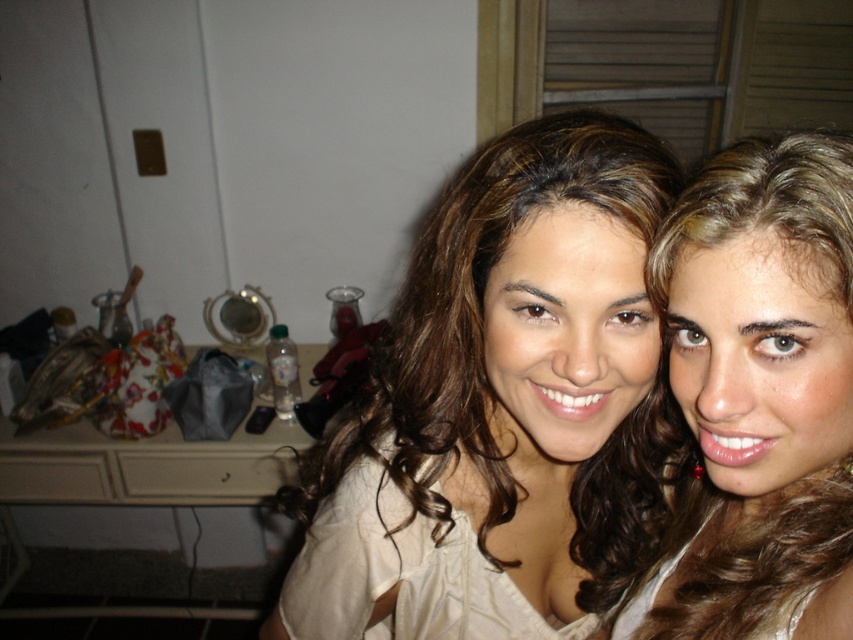
Who is higher up, matte beige blouse at center or blonde hair at center?

blonde hair at center

You are a GUI agent. You are given a task and a screenshot of the screen. Output one action in this format:
    pyautogui.click(x=<x>, y=<y>)
    Task: Click on the matte beige blouse at center
    The width and height of the screenshot is (853, 640).
    Given the screenshot: What is the action you would take?
    pyautogui.click(x=500, y=404)